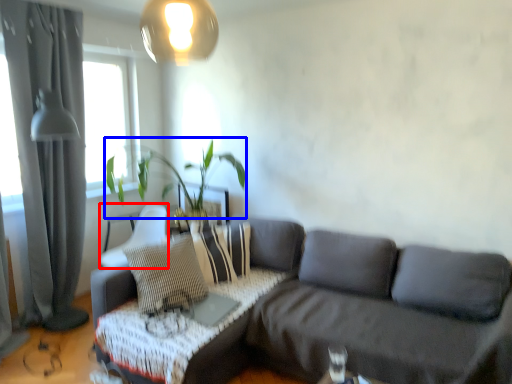
Question: Which point is closer to the camera, armchair (highlighted by a red box) or plant (highlighted by a blue box)?

Choices:
 (A) armchair
 (B) plant

Answer: (B)